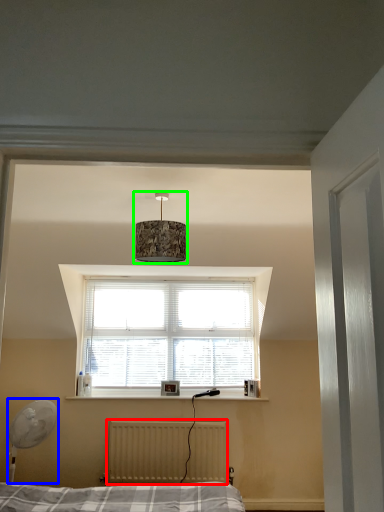
Question: Based on their relative distances, which object is nearer to radiator (highlighted by a red box)? Choose from table lamp (highlighted by a blue box) and lamp (highlighted by a green box).

Choices:
 (A) table lamp
 (B) lamp

Answer: (A)